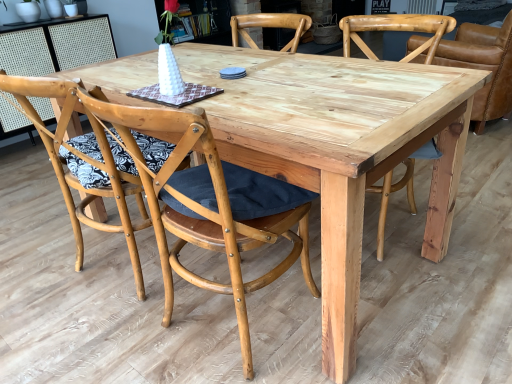
Where is `vacant space in front of natural wood chair at center, which ranks as the first chair in left-to-right order`? vacant space in front of natural wood chair at center, which ranks as the first chair in left-to-right order is located at coordinates (84, 341).